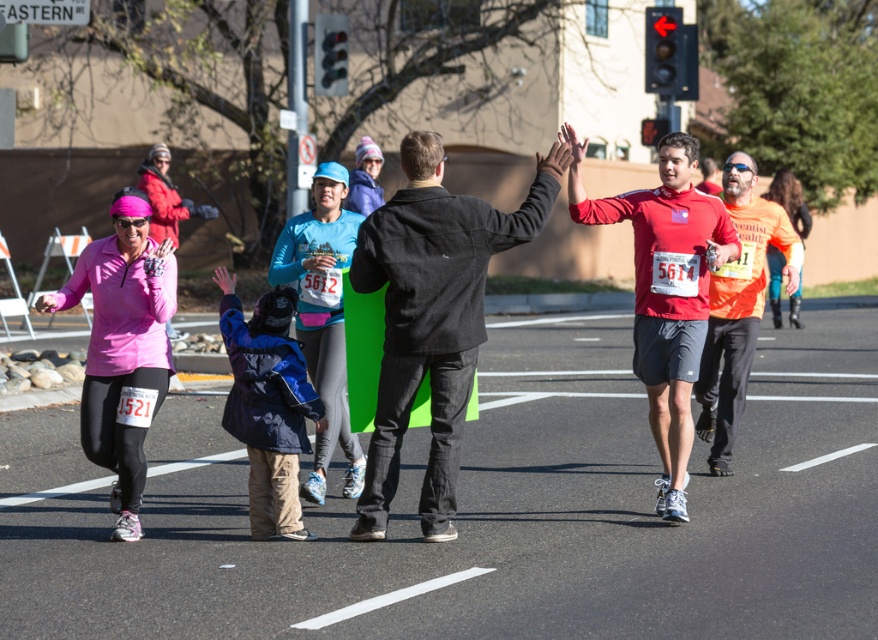
Can you confirm if matte pink jacket at left is positioned to the right of orange fabric shirt at right?

A: In fact, matte pink jacket at left is to the left of orange fabric shirt at right.

In the scene shown: Between matte pink jacket at left and orange fabric shirt at right, which one appears on the left side from the viewer's perspective?

From the viewer's perspective, matte pink jacket at left appears more on the left side.

Does point (119, 369) come farther from viewer compared to point (749, 204)?

No, (119, 369) is in front of (749, 204).

The image size is (878, 640). In order to click on matte pink jacket at left in this screenshot , I will do `click(123, 348)`.

Between dark gray jacket at center and matte red shirt at center, which one has more height?

matte red shirt at center

Does dark gray jacket at center lie behind matte red shirt at center?

No, dark gray jacket at center is in front of matte red shirt at center.

Find the location of a particular element. This screenshot has height=640, width=878. dark gray jacket at center is located at coordinates (432, 316).

In order to click on dark gray jacket at center in this screenshot , I will do `click(432, 316)`.

Who is taller, dark gray jacket at center or orange fabric shirt at right?

dark gray jacket at center

Is point (440, 365) behind point (715, 467)?

No, (440, 365) is closer to viewer.

Is point (437, 195) positioned behind point (728, 451)?

No, (437, 195) is closer to viewer.

The image size is (878, 640). What are the coordinates of `dark gray jacket at center` in the screenshot? It's located at (432, 316).